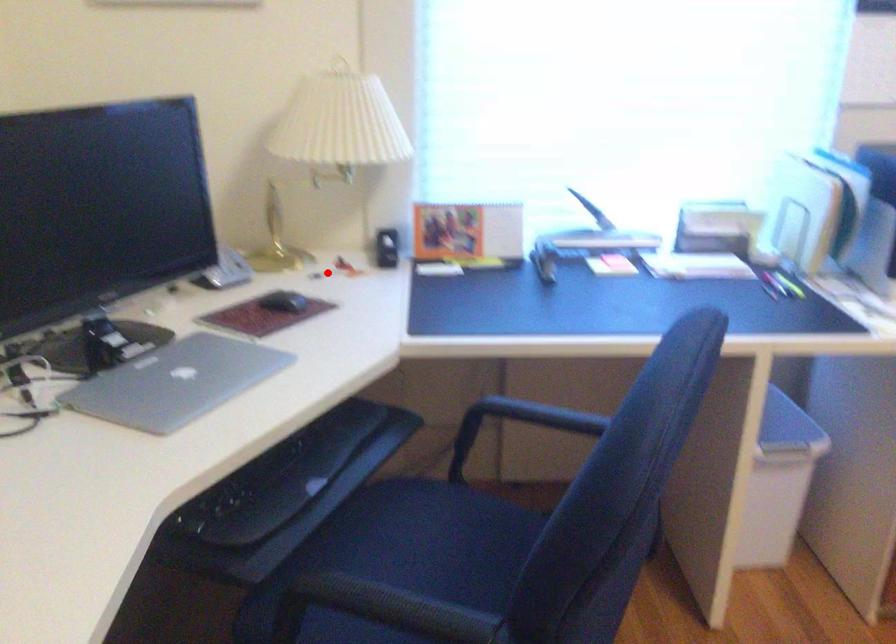
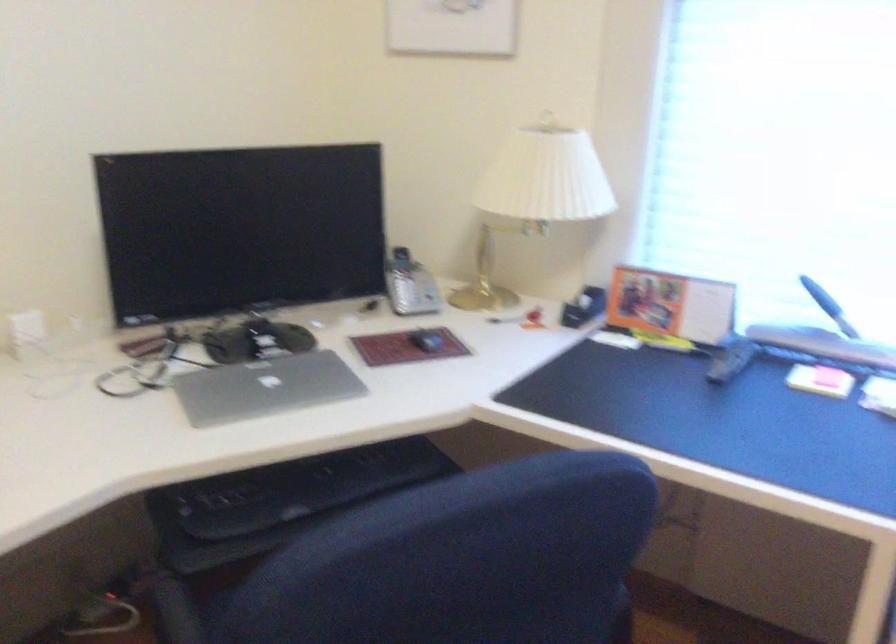
In the second image, find the point that corresponds to the highlighted location in the first image.

(504, 319)